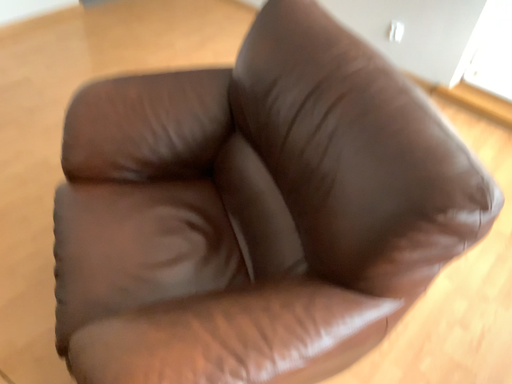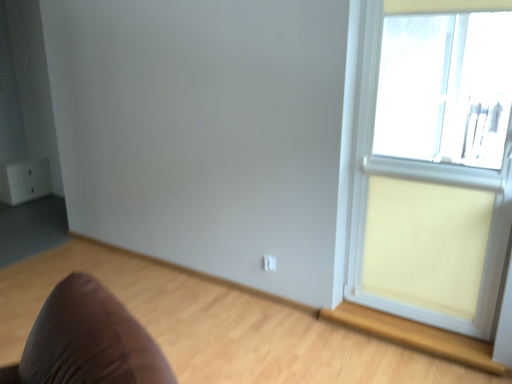
Question: How did the camera likely rotate when shooting the video?

Choices:
 (A) rotated upward
 (B) rotated downward

Answer: (A)